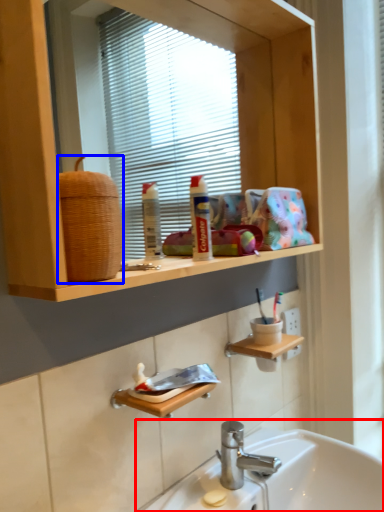
Question: Which object is further to the camera taking this photo, sink (highlighted by a red box) or basket (highlighted by a blue box)?

Choices:
 (A) sink
 (B) basket

Answer: (A)